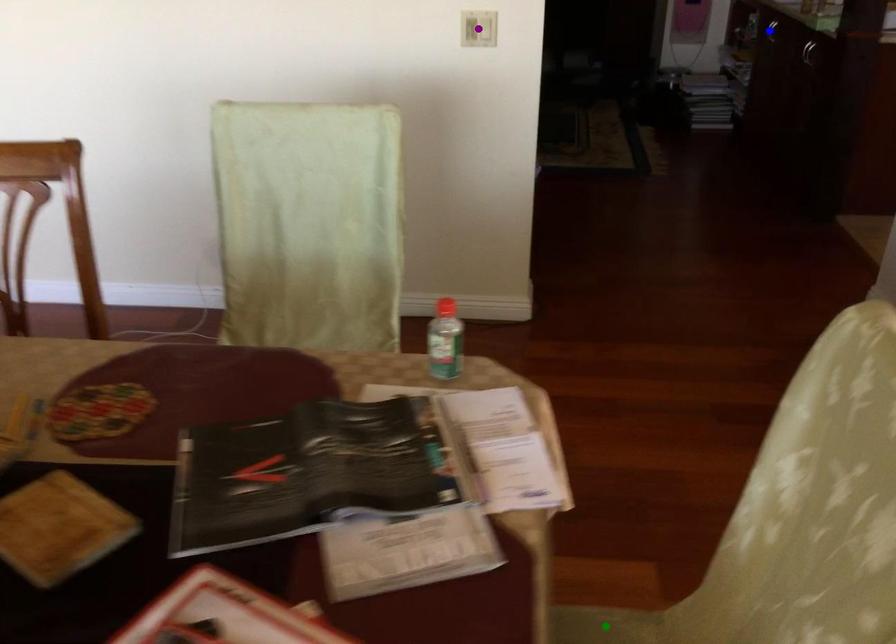
Order these from farthest to nearest:
- purple point
- green point
- blue point

blue point < purple point < green point